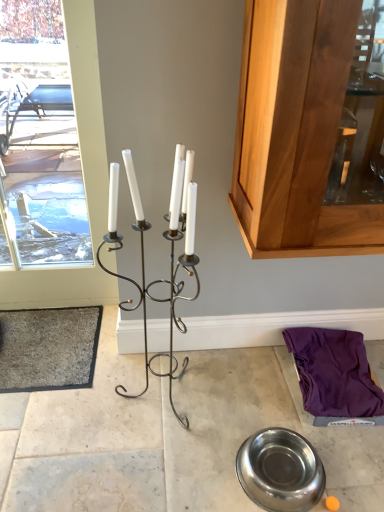
You are a GUI agent. You are given a task and a screenshot of the screen. Output one action in this format:
    pyautogui.click(x=<x>, y=<y>)
    Task: Click on the unoccupied region to the right of gray carpet at lower left
    This screenshot has height=512, width=384.
    Given the screenshot: What is the action you would take?
    pyautogui.click(x=129, y=379)